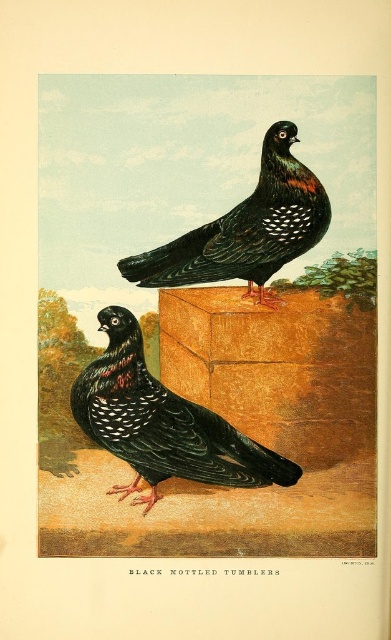
Does black speckled pigeon at center have a smaller size compared to black speckled pigeon at upper center?

Yes.

What do you see at coordinates (161, 422) in the screenshot? I see `black speckled pigeon at center` at bounding box center [161, 422].

Locate an element on the screen. black speckled pigeon at center is located at coordinates (161, 422).

What do you see at coordinates (208, 316) in the screenshot?
I see `black glossy tumbler at upper center` at bounding box center [208, 316].

The image size is (391, 640). Find the location of `black glossy tumbler at upper center`. black glossy tumbler at upper center is located at coordinates (208, 316).

Locate an element on the screen. black glossy tumbler at upper center is located at coordinates (208, 316).

Does black glossy tumbler at upper center have a lesser width compared to black speckled pigeon at upper center?

No.

What do you see at coordinates (208, 316) in the screenshot?
I see `black glossy tumbler at upper center` at bounding box center [208, 316].

Is point (304, 291) in front of point (188, 272)?

Yes, point (304, 291) is closer to viewer.

The image size is (391, 640). Identify the location of black glossy tumbler at upper center. (208, 316).